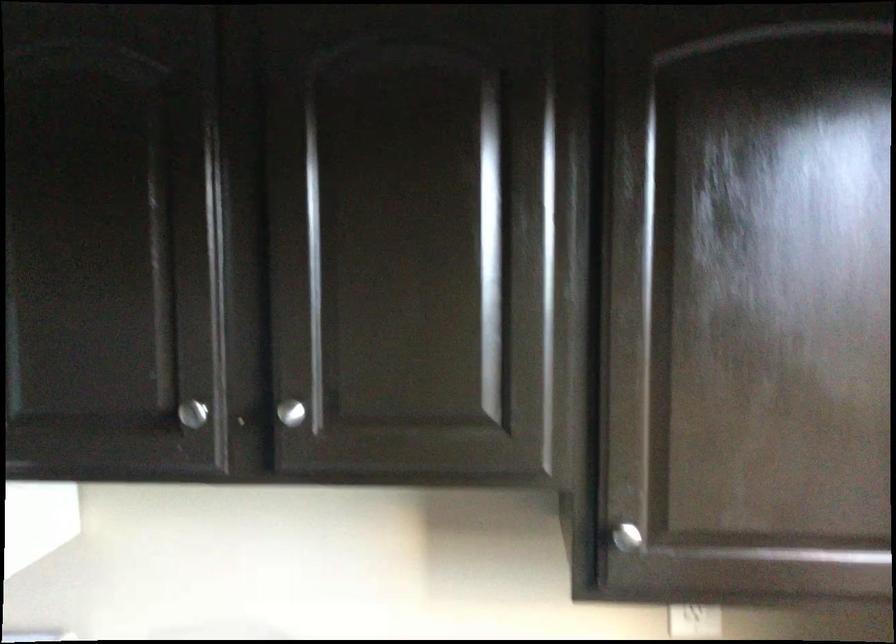
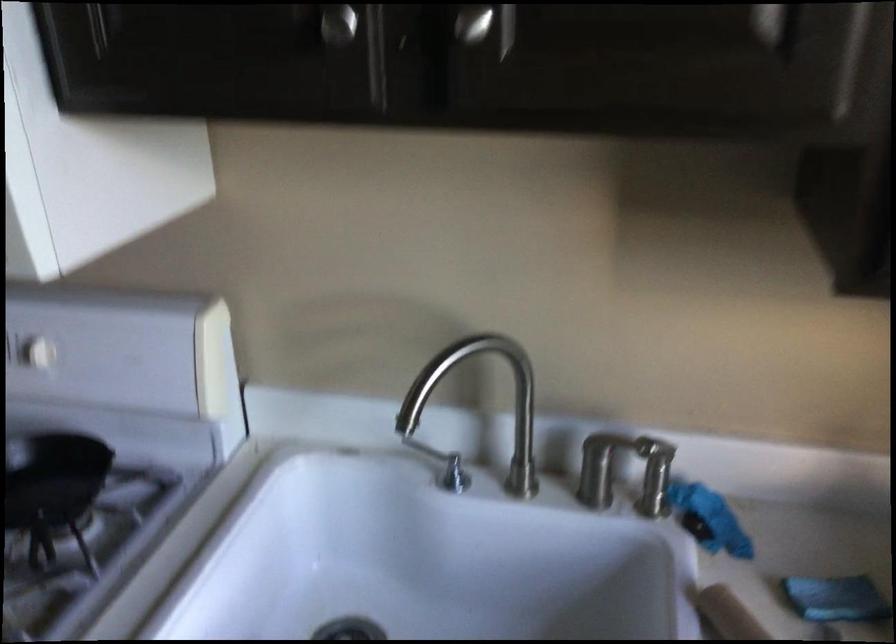
Locate, in the second image, the point that corresponds to point (288, 413) in the first image.

(472, 23)